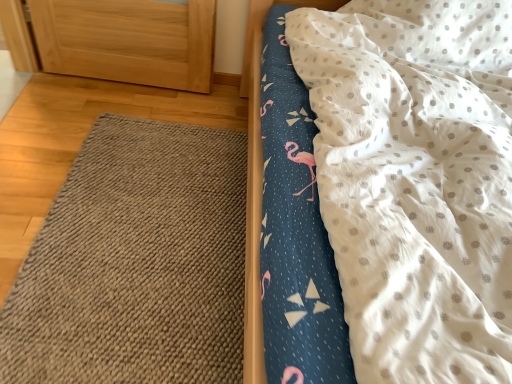
At what (x,y) coordinates should I click in order to perform the action: click on brown woven mat at lower left. Please return your answer as a coordinate pair (x, y). The image size is (512, 384). Looking at the image, I should click on (136, 263).

What do you see at coordinates (136, 263) in the screenshot? I see `brown woven mat at lower left` at bounding box center [136, 263].

From the picture: Measure the distance between brown woven mat at lower left and camera.

They are 3.58 feet apart.

Measure the distance between point (x=418, y=125) and camera.

The depth of point (x=418, y=125) is 4.03 feet.

In order to click on white dotted fabric at upper right in this screenshot , I will do `click(404, 176)`.

What do you see at coordinates (404, 176) in the screenshot? I see `white dotted fabric at upper right` at bounding box center [404, 176].

The width and height of the screenshot is (512, 384). What are the coordinates of `brown woven mat at lower left` in the screenshot? It's located at (136, 263).

Between white dotted fabric at upper right and brown woven mat at lower left, which one appears on the left side from the viewer's perspective?

brown woven mat at lower left is more to the left.

Based on the photo, is the depth of white dotted fabric at upper right greater than that of brown woven mat at lower left?

No, white dotted fabric at upper right is closer to the viewer.

Considering the positions of points (285, 50) and (208, 301), is point (285, 50) closer to camera compared to point (208, 301)?

That is False.

From the image's perspective, which is below, white dotted fabric at upper right or brown woven mat at lower left?

brown woven mat at lower left, from the image's perspective.

From a real-world perspective, is white dotted fabric at upper right positioned under brown woven mat at lower left based on gravity?

No, from a real-world perspective, white dotted fabric at upper right is not under brown woven mat at lower left.

Which object is thinner, white dotted fabric at upper right or brown woven mat at lower left?

Thinner between the two is brown woven mat at lower left.

Is white dotted fabric at upper right taller than brown woven mat at lower left?

Yes.

Is white dotted fabric at upper right bigger than brown woven mat at lower left?

Indeed, white dotted fabric at upper right has a larger size compared to brown woven mat at lower left.

Does white dotted fabric at upper right contain brown woven mat at lower left?

No, brown woven mat at lower left is not inside white dotted fabric at upper right.

Is white dotted fabric at upper right next to brown woven mat at lower left and touching it?

There is a gap between white dotted fabric at upper right and brown woven mat at lower left.

Could you tell me if white dotted fabric at upper right is facing brown woven mat at lower left?

No, white dotted fabric at upper right is not turned towards brown woven mat at lower left.

Can you tell me how much white dotted fabric at upper right and brown woven mat at lower left differ in facing direction?

The facing directions of white dotted fabric at upper right and brown woven mat at lower left are 86.6 degrees apart.

This screenshot has width=512, height=384. I want to click on mat below the white dotted fabric at upper right (from a real-world perspective), so click(136, 263).

Is brown woven mat at lower left at the left side of white dotted fabric at upper right?

Yes.

Which object is more forward, brown woven mat at lower left or white dotted fabric at upper right?

white dotted fabric at upper right.

Does point (30, 258) appear closer or farther from the camera than point (379, 350)?

Point (30, 258).

From the image's perspective, which is above, brown woven mat at lower left or white dotted fabric at upper right?

white dotted fabric at upper right is shown above in the image.

From a real-world perspective, which object rests below the other?

brown woven mat at lower left.

Considering the sizes of objects brown woven mat at lower left and white dotted fabric at upper right in the image provided, who is wider, brown woven mat at lower left or white dotted fabric at upper right?

white dotted fabric at upper right is wider.

Looking at this image, is brown woven mat at lower left taller or shorter than white dotted fabric at upper right?

In the image, brown woven mat at lower left appears to be shorter than white dotted fabric at upper right.

Based on their sizes in the image, would you say brown woven mat at lower left is bigger or smaller than white dotted fabric at upper right?

Considering their sizes, brown woven mat at lower left takes up less space than white dotted fabric at upper right.

Is brown woven mat at lower left located outside white dotted fabric at upper right?

Yes, brown woven mat at lower left is outside of white dotted fabric at upper right.

Is the surface of brown woven mat at lower left in direct contact with white dotted fabric at upper right?

No, brown woven mat at lower left is not with white dotted fabric at upper right.

Could you tell me if brown woven mat at lower left is facing white dotted fabric at upper right?

Yes, brown woven mat at lower left is turned towards white dotted fabric at upper right.

You are a GUI agent. You are given a task and a screenshot of the screen. Output one action in this format:
    pyautogui.click(x=<x>, y=<y>)
    Task: Click on the mat lying behind the white dotted fabric at upper right
    The height and width of the screenshot is (384, 512).
    Given the screenshot: What is the action you would take?
    pyautogui.click(x=136, y=263)

Where is `mat on the left of the white dotted fabric at upper right`? mat on the left of the white dotted fabric at upper right is located at coordinates (136, 263).

Locate an element on the screen. This screenshot has width=512, height=384. bed in front of the brown woven mat at lower left is located at coordinates (404, 176).